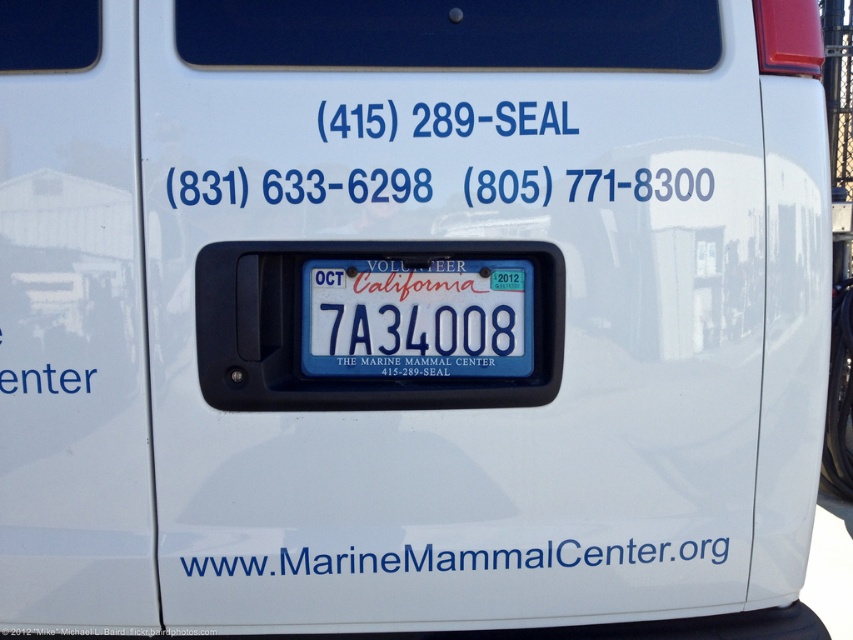
What are the coordinates of the blue plastic license plate at center?

The blue plastic license plate at center is located at coordinates point (416, 317).

You are a delivery driver who needs to read the phone numbers on the van. The blue plastic license plate at center has a glossy surface that might reflect sunlight. Considering the white plastic text at lower center is less reflective, which part should you look at to avoid glare?

The white plastic text at lower center is less reflective than the blue plastic license plate at center, so you should look at the white plastic text at lower center to avoid glare.